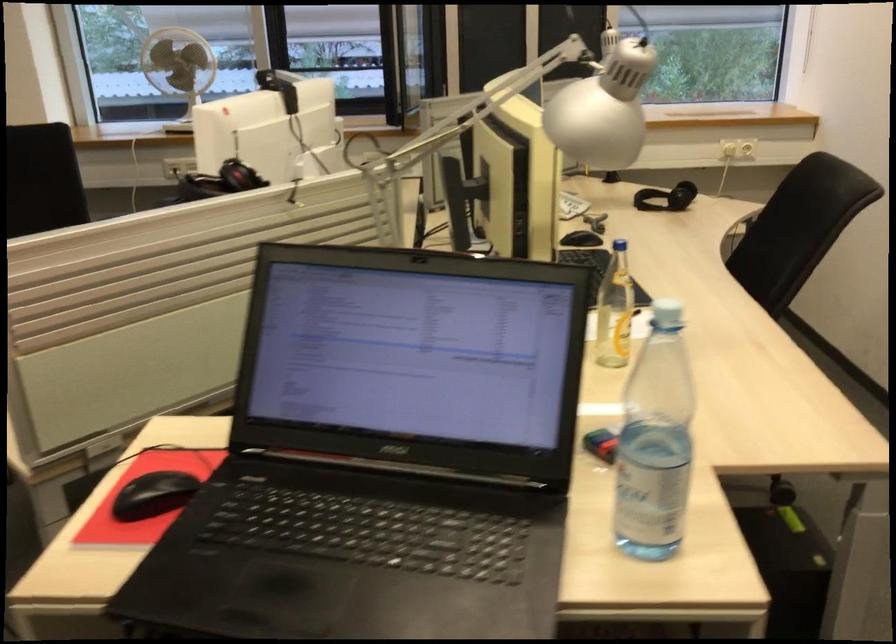
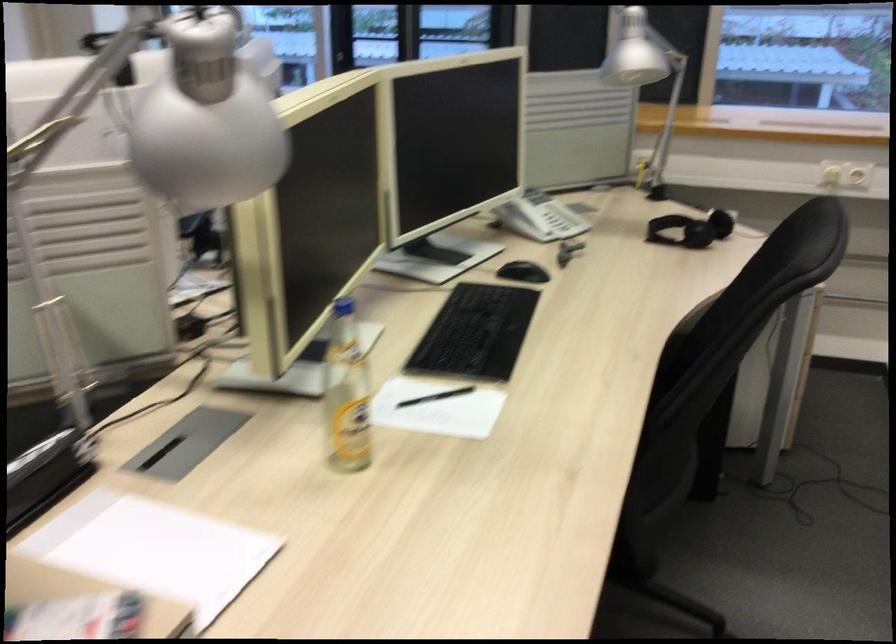
What movement of the cameraman would produce the second image?

The cameraman moved toward right, forward.